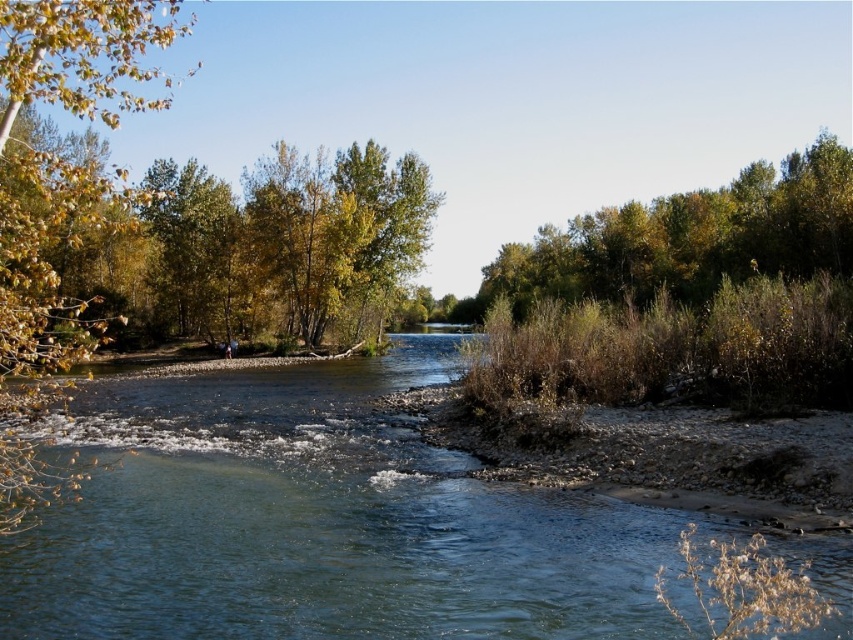
You are a hiker who wants to cross the river using the safest path. The clear blue water at center and the green leafy tree at upper right are visible from your current position. Which direction should you head towards to find the safest path?

The clear blue water at center is positioned on the left side of green leafy tree at upper right. Since clear blue water typically indicates calmer and shallower areas, you should head towards the clear blue water at center to find the safest path for crossing the river.